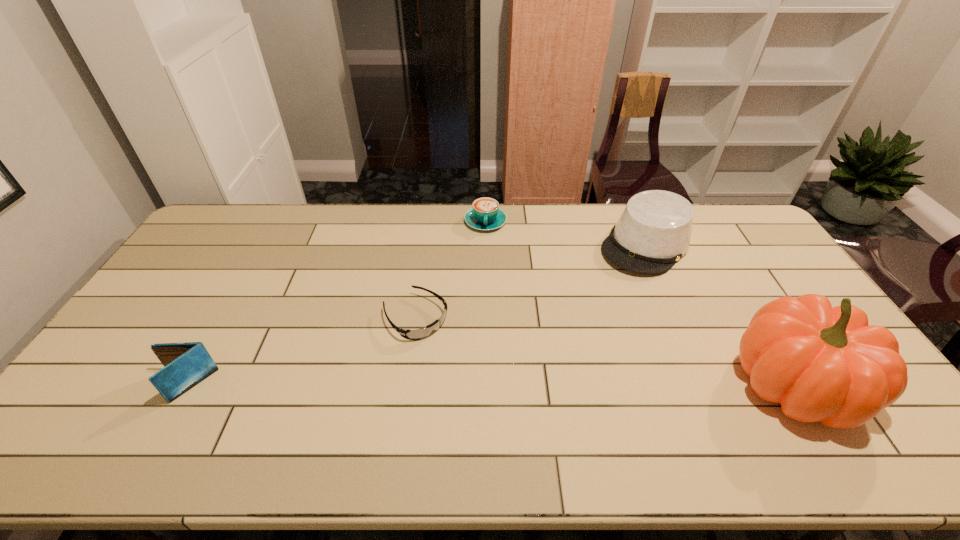
Where is `free location located on the exterior surface of the third shortest object`? free location located on the exterior surface of the third shortest object is located at coordinates (121, 386).

Where is `blank area located on the back of the pumpkin`? blank area located on the back of the pumpkin is located at coordinates (759, 323).

This screenshot has width=960, height=540. I want to click on free space located 0.340m on the lenses of the shortest object, so click(523, 416).

Where is `vacant space situated 0.290m on the lenses of the shortest object`? vacant space situated 0.290m on the lenses of the shortest object is located at coordinates (509, 402).

Where is `vacant space located 0.160m on the lenses of the shortest object`? vacant space located 0.160m on the lenses of the shortest object is located at coordinates (473, 370).

The width and height of the screenshot is (960, 540). I want to click on vacant area situated on the front-facing side of the second tallest object, so click(x=601, y=294).

Locate an element on the screen. This screenshot has height=540, width=960. vacant space situated 0.390m on the front-facing side of the second tallest object is located at coordinates (560, 340).

What are the coordinates of `vacant space situated on the front-facing side of the second tallest object` in the screenshot? It's located at (585, 312).

Identify the location of vacant space located with the handle on the right side of the third object from right to left. (485, 245).

You are a GUI agent. You are given a task and a screenshot of the screen. Output one action in this format:
    pyautogui.click(x=<x>, y=<y>)
    Task: Click on the free space located 0.380m with the handle on the right side of the third object from right to left
    This screenshot has height=540, width=960.
    Given the screenshot: What is the action you would take?
    pyautogui.click(x=485, y=312)